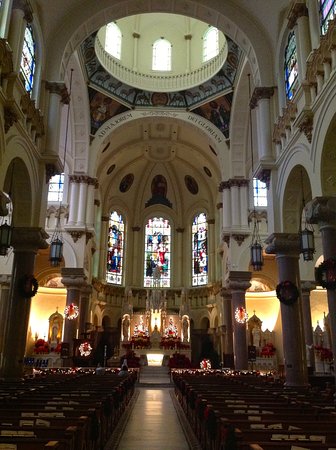
This screenshot has width=336, height=450. I want to click on stained glass window, so click(27, 61), click(290, 55), click(329, 10), click(116, 252), click(156, 254), click(202, 259).